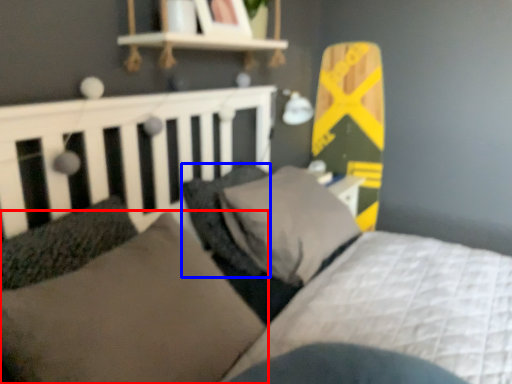
Question: Which object is further to the camera taking this photo, pillow (highlighted by a red box) or pillow (highlighted by a blue box)?

Choices:
 (A) pillow
 (B) pillow

Answer: (B)